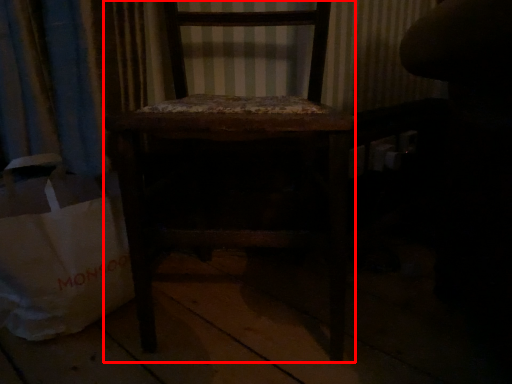
Question: From the image's perspective, what is the correct spatial relationship of chair (annotated by the red box) in relation to grocery bag?

Choices:
 (A) above
 (B) below

Answer: (A)